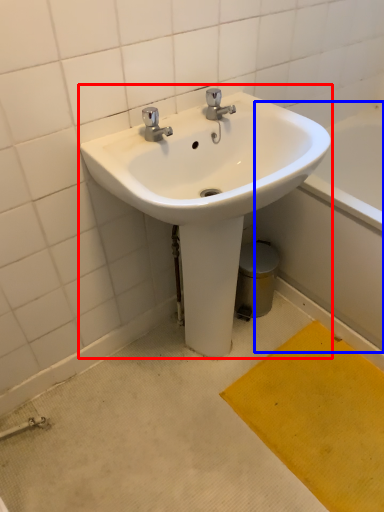
Question: Which object is further to the camera taking this photo, sink (highlighted by a red box) or bath (highlighted by a blue box)?

Choices:
 (A) sink
 (B) bath

Answer: (B)